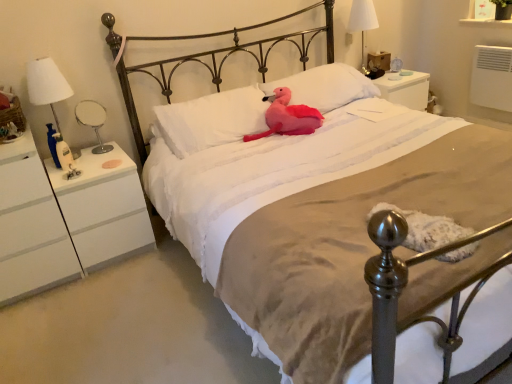
Where is `blank space situated above white matte nightstand at left (from a real-world perspective)`? The height and width of the screenshot is (384, 512). blank space situated above white matte nightstand at left (from a real-world perspective) is located at coordinates pyautogui.click(x=89, y=167).